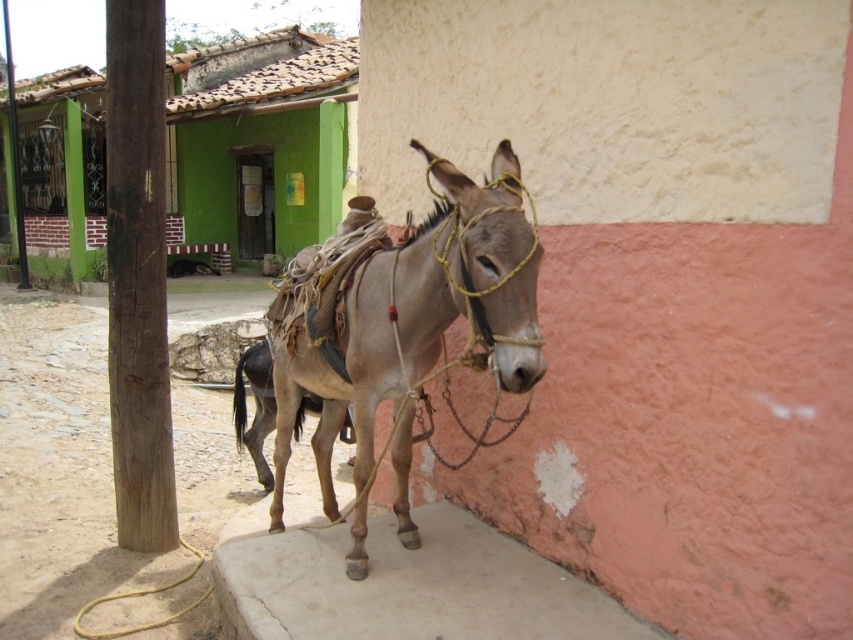
Between light brown leather donkey at center and grayish-brown leather mule at center, which one appears on the left side from the viewer's perspective?

From the viewer's perspective, grayish-brown leather mule at center appears more on the left side.

Who is shorter, light brown leather donkey at center or grayish-brown leather mule at center?

Standing shorter between the two is grayish-brown leather mule at center.

Where is `light brown leather donkey at center`? Image resolution: width=853 pixels, height=640 pixels. light brown leather donkey at center is located at coordinates (403, 324).

This screenshot has height=640, width=853. What are the coordinates of `light brown leather donkey at center` in the screenshot? It's located at [403, 324].